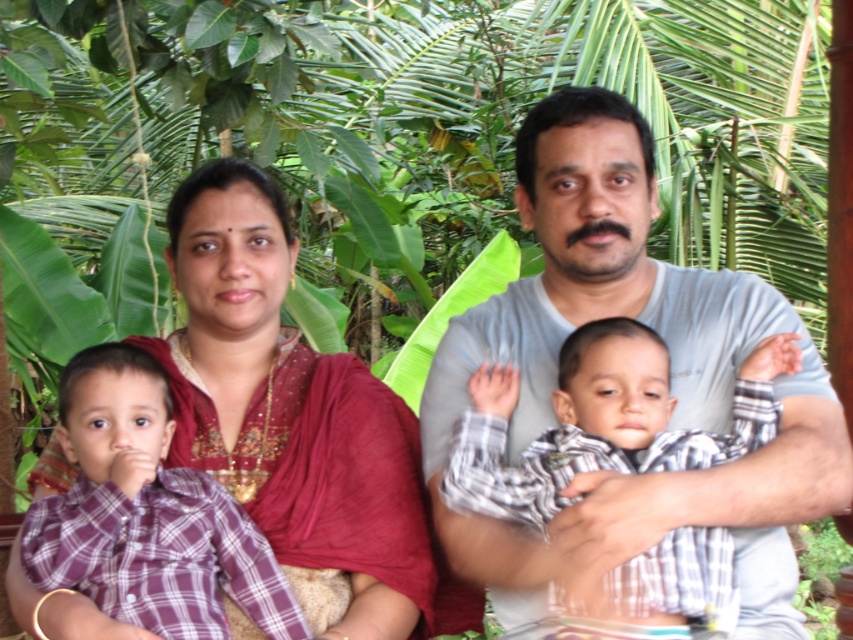
Question: Which point is farther to the camera?

Choices:
 (A) purple plaid shirt at left
 (B) plaid cotton shirt at center
 (C) matte red saree at center

Answer: (C)

Question: Can you confirm if gray cotton shirt at center is positioned to the right of plaid cotton shirt at center?

Choices:
 (A) yes
 (B) no

Answer: (A)

Question: Which point is closer to the camera?

Choices:
 (A) (769, 353)
 (B) (235, 195)
 (C) (108, 508)
 (D) (781, 444)

Answer: (C)

Question: Which of the following is the closest to the observer?

Choices:
 (A) (238, 445)
 (B) (729, 420)
 (C) (677, 586)
 (D) (126, 582)

Answer: (C)

Question: Can you confirm if matte red saree at center is smaller than purple plaid shirt at left?

Choices:
 (A) yes
 (B) no

Answer: (B)

Question: Is matte red saree at center positioned in front of purple plaid shirt at left?

Choices:
 (A) no
 (B) yes

Answer: (A)